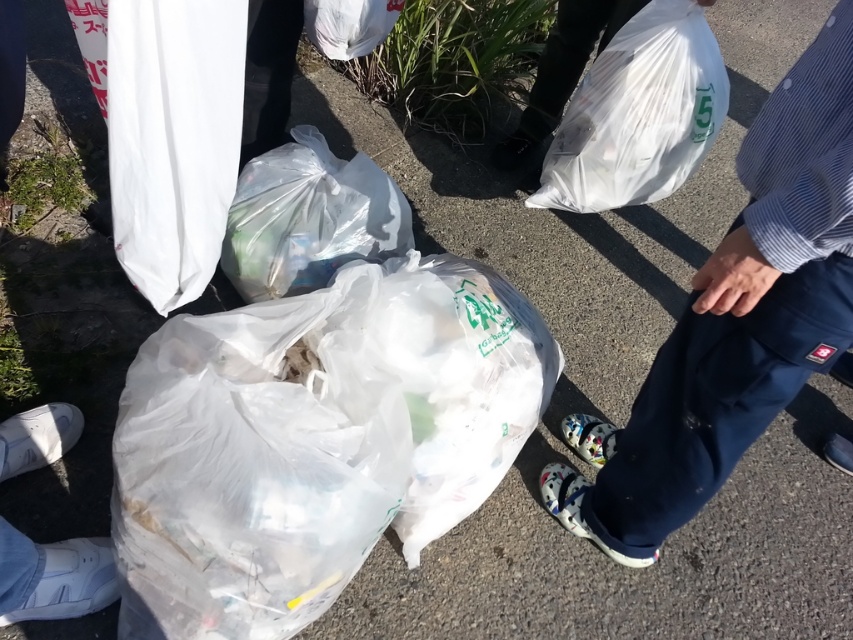
Between transparent plastic bag at center and white matte sneakers at lower left, which one appears on the left side from the viewer's perspective?

From the viewer's perspective, white matte sneakers at lower left appears more on the left side.

Image resolution: width=853 pixels, height=640 pixels. What are the coordinates of `transparent plastic bag at center` in the screenshot? It's located at (315, 440).

This screenshot has height=640, width=853. Find the location of `transparent plastic bag at center`. transparent plastic bag at center is located at coordinates (315, 440).

Identify the location of transparent plastic bag at upper right. (637, 115).

Does transparent plastic bag at upper right have a greater width compared to white matte sneakers at lower left?

Indeed, transparent plastic bag at upper right has a greater width compared to white matte sneakers at lower left.

Who is more forward, (630, 148) or (57, 420)?

Point (57, 420)

Image resolution: width=853 pixels, height=640 pixels. I want to click on transparent plastic bag at upper right, so click(x=637, y=115).

Does transparent plastic bag at upper right have a larger size compared to translucent plastic bag at center?

Yes, transparent plastic bag at upper right is bigger than translucent plastic bag at center.

Between transparent plastic bag at upper right and translucent plastic bag at center, which one is positioned lower?

translucent plastic bag at center is lower down.

This screenshot has width=853, height=640. I want to click on transparent plastic bag at upper right, so click(x=637, y=115).